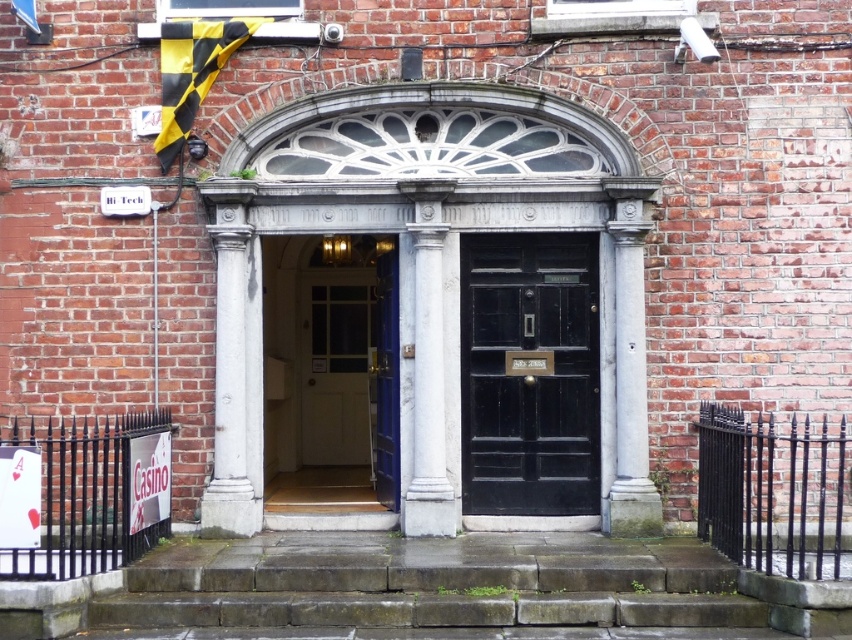
You are a delivery person trying to enter the building through the entrance. You need to know if the white wooden door at center can be opened fully without hitting the white stone column at center. Can it?

The white wooden door at center is shorter than the white stone column at center, so opening the door fully should not hit the column since the door is shorter and likely positioned below the column.

You are a delivery person carrying a package that is 6 feet long. You need to move it through the entrance of the building. The dark grey stone steps at center and white marble column at left are in your path. Can you safely navigate the package around these obstacles?

The dark grey stone steps at center is 5.07 feet from the white marble column at left. Since the package is 6 feet long, it is longer than the distance between the two obstacles, making it difficult to navigate safely. You may need to find an alternative route or reposition the package to ensure it can fit between them without obstruction.

You are an architect inspecting the building entrance. You notice two columns at the center. Which column is narrower between the white marble column at center and the white stone column at center?

The white marble column at center is narrower than the white stone column at center.